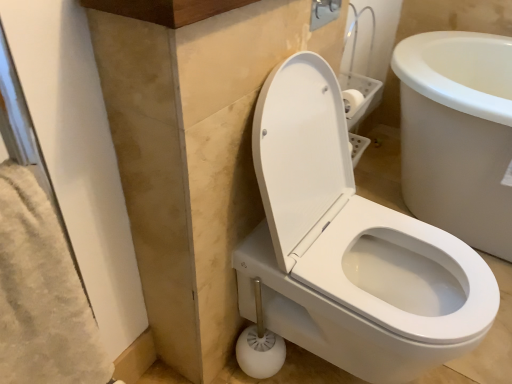
Find the location of `white glossy toilet at center`. white glossy toilet at center is located at coordinates (349, 247).

Describe the element at coordinates (349, 247) in the screenshot. I see `white glossy toilet at center` at that location.

Measure the distance between point (273, 345) and camera.

Point (273, 345) is 3.84 feet away from camera.

Describe the element at coordinates (260, 344) in the screenshot. The image size is (512, 384). I see `white plastic toilet brush at lower center` at that location.

The width and height of the screenshot is (512, 384). What are the coordinates of `white plastic toilet brush at lower center` in the screenshot? It's located at (260, 344).

At what (x,y) coordinates should I click in order to perform the action: click on white glossy toilet at center. Please return your answer as a coordinate pair (x, y). The width and height of the screenshot is (512, 384). Looking at the image, I should click on (349, 247).

Can you confirm if white glossy toilet at center is positioned to the right of white plastic toilet brush at lower center?

Yes.

Which object is closer to the camera taking this photo, white glossy toilet at center or white plastic toilet brush at lower center?

white glossy toilet at center.

From the picture: Which point is more distant from viewer, (x=333, y=243) or (x=277, y=341)?

The point (x=277, y=341) is farther.

From the image's perspective, does white glossy toilet at center appear higher than white plastic toilet brush at lower center?

Yes.

From a real-world perspective, who is located higher, white glossy toilet at center or white plastic toilet brush at lower center?

white glossy toilet at center is physically above.

Considering the relative sizes of white glossy toilet at center and white plastic toilet brush at lower center in the image provided, is white glossy toilet at center thinner than white plastic toilet brush at lower center?

In fact, white glossy toilet at center might be wider than white plastic toilet brush at lower center.

Considering the sizes of white glossy toilet at center and white plastic toilet brush at lower center in the image, is white glossy toilet at center taller or shorter than white plastic toilet brush at lower center?

Clearly, white glossy toilet at center is taller compared to white plastic toilet brush at lower center.

Considering the sizes of objects white glossy toilet at center and white plastic toilet brush at lower center in the image provided, who is bigger, white glossy toilet at center or white plastic toilet brush at lower center?

white glossy toilet at center.

Could white plastic toilet brush at lower center be considered to be inside white glossy toilet at center?

Indeed, white plastic toilet brush at lower center is located within white glossy toilet at center.

Is white glossy toilet at center next to white plastic toilet brush at lower center?

No, white glossy toilet at center is not in contact with white plastic toilet brush at lower center.

Is white glossy toilet at center facing away from white plastic toilet brush at lower center?

Yes, white glossy toilet at center's orientation is away from white plastic toilet brush at lower center.

Image resolution: width=512 pixels, height=384 pixels. Identify the location of shower below the white glossy toilet at center (from a real-world perspective). (260, 344).

Does white plastic toilet brush at lower center appear on the left side of white glossy toilet at center?

Indeed, white plastic toilet brush at lower center is positioned on the left side of white glossy toilet at center.

Is the position of white plastic toilet brush at lower center less distant than that of white glossy toilet at center?

No, white plastic toilet brush at lower center is behind white glossy toilet at center.

Does point (248, 353) lie behind point (440, 264)?

Yes, point (248, 353) is farther from viewer.

From the image's perspective, is white plastic toilet brush at lower center above or below white glossy toilet at center?

Based on their image positions, white plastic toilet brush at lower center is located beneath white glossy toilet at center.

From a real-world perspective, is white plastic toilet brush at lower center above or below white glossy toilet at center?

white plastic toilet brush at lower center is situated lower than white glossy toilet at center in the real world.

Which of these two, white plastic toilet brush at lower center or white glossy toilet at center, is wider?

With larger width is white glossy toilet at center.

Does white plastic toilet brush at lower center have a greater height compared to white glossy toilet at center?

Incorrect, the height of white plastic toilet brush at lower center is not larger of that of white glossy toilet at center.

Considering the relative sizes of white plastic toilet brush at lower center and white glossy toilet at center in the image provided, is white plastic toilet brush at lower center smaller than white glossy toilet at center?

Indeed, white plastic toilet brush at lower center has a smaller size compared to white glossy toilet at center.

Is white plastic toilet brush at lower center located outside white glossy toilet at center?

No, white plastic toilet brush at lower center is inside white glossy toilet at center's boundary.

Is white plastic toilet brush at lower center not near white glossy toilet at center?

No, white plastic toilet brush at lower center is not far from white glossy toilet at center.

Does white plastic toilet brush at lower center turn towards white glossy toilet at center?

Yes.

What's the angular difference between white plastic toilet brush at lower center and white glossy toilet at center's facing directions?

1.46 degrees.

I want to click on toilet above the white plastic toilet brush at lower center (from a real-world perspective), so click(x=349, y=247).

At what (x,y) coordinates should I click in order to perform the action: click on shower on the left of white glossy toilet at center. Please return your answer as a coordinate pair (x, y). Looking at the image, I should click on (260, 344).

You are a GUI agent. You are given a task and a screenshot of the screen. Output one action in this format:
    pyautogui.click(x=<x>, y=<y>)
    Task: Click on the shower that appears below the white glossy toilet at center (from the image's perspective)
    
    Given the screenshot: What is the action you would take?
    pyautogui.click(x=260, y=344)